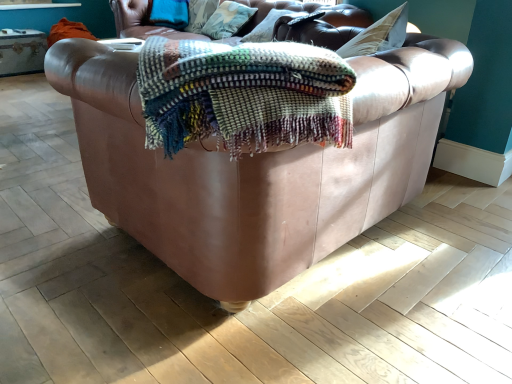
Question: Which direction should I rotate to look at textured cotton pillow at upper center, which is counted as the second pillow, starting from the right, — up or down?

Choices:
 (A) up
 (B) down

Answer: (A)

Question: Is leather couch at center smaller than textured cotton pillow at upper center, which is counted as the second pillow, starting from the right?

Choices:
 (A) no
 (B) yes

Answer: (A)

Question: Could you tell me if leather couch at center is turned towards textured cotton pillow at upper center, which is counted as the second pillow, starting from the right?

Choices:
 (A) yes
 (B) no

Answer: (A)

Question: Is leather couch at center at the right side of textured cotton pillow at upper center, acting as the first pillow starting from the left?

Choices:
 (A) yes
 (B) no

Answer: (A)

Question: Is leather couch at center surrounding textured cotton pillow at upper center, which is counted as the second pillow, starting from the right?

Choices:
 (A) no
 (B) yes

Answer: (A)

Question: Does leather couch at center come in front of textured cotton pillow at upper center, acting as the first pillow starting from the left?

Choices:
 (A) no
 (B) yes

Answer: (B)

Question: From a real-world perspective, is leather couch at center beneath textured cotton pillow at upper center, acting as the first pillow starting from the left?

Choices:
 (A) yes
 (B) no

Answer: (A)

Question: From the image's perspective, does textured cotton pillow at upper center, acting as the first pillow starting from the left, appear higher than velvet cushion at upper center, the 1th pillow from the right?

Choices:
 (A) yes
 (B) no

Answer: (A)

Question: Considering the relative sizes of textured cotton pillow at upper center, which is counted as the second pillow, starting from the right, and velvet cushion at upper center, the second pillow in the left-to-right sequence, in the image provided, is textured cotton pillow at upper center, which is counted as the second pillow, starting from the right, thinner than velvet cushion at upper center, the second pillow in the left-to-right sequence,?

Choices:
 (A) no
 (B) yes

Answer: (B)

Question: Does textured cotton pillow at upper center, acting as the first pillow starting from the left, lie behind velvet cushion at upper center, the 1th pillow from the right?

Choices:
 (A) yes
 (B) no

Answer: (A)

Question: Does textured cotton pillow at upper center, acting as the first pillow starting from the left, have a lesser height compared to velvet cushion at upper center, the second pillow in the left-to-right sequence?

Choices:
 (A) no
 (B) yes

Answer: (A)

Question: Considering the relative positions of textured cotton pillow at upper center, acting as the first pillow starting from the left, and velvet cushion at upper center, the second pillow in the left-to-right sequence, in the image provided, is textured cotton pillow at upper center, acting as the first pillow starting from the left, to the left of velvet cushion at upper center, the second pillow in the left-to-right sequence, from the viewer's perspective?

Choices:
 (A) no
 (B) yes

Answer: (B)

Question: Does textured cotton pillow at upper center, acting as the first pillow starting from the left, touch velvet cushion at upper center, the 1th pillow from the right?

Choices:
 (A) no
 (B) yes

Answer: (A)

Question: Is velvet cushion at upper center, the 1th pillow from the right, not inside textured cotton pillow at upper center, which is counted as the second pillow, starting from the right?

Choices:
 (A) yes
 (B) no

Answer: (A)